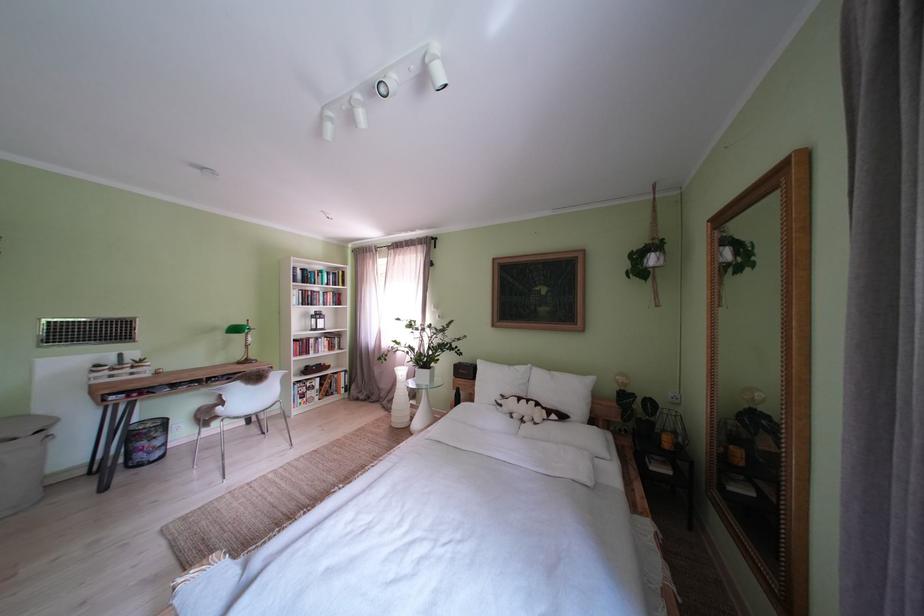
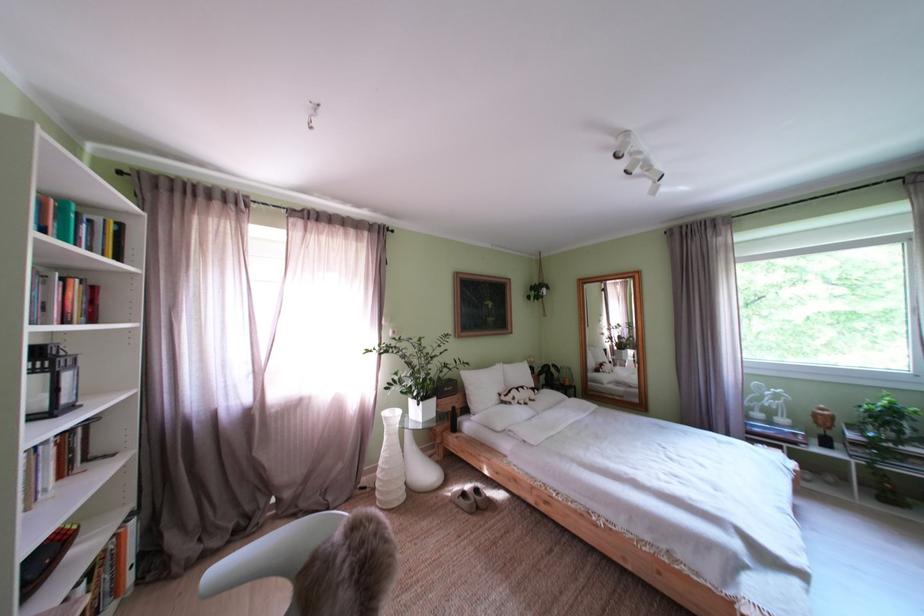
The point at (x=546, y=426) is marked in the first image. Where is the corresponding point in the second image?

(543, 403)